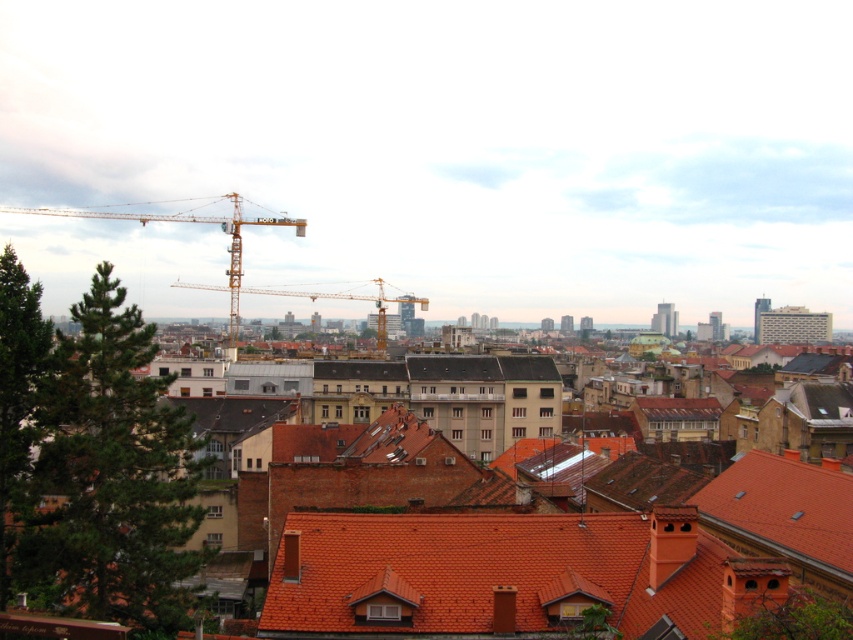
Is yellow metallic crane at upper center in front of metallic yellow crane at center?

Yes, yellow metallic crane at upper center is in front of metallic yellow crane at center.

Does yellow metallic crane at upper center have a larger size compared to metallic yellow crane at center?

Yes, yellow metallic crane at upper center is bigger than metallic yellow crane at center.

This screenshot has height=640, width=853. What do you see at coordinates (238, 257) in the screenshot?
I see `yellow metallic crane at upper center` at bounding box center [238, 257].

Where is `yellow metallic crane at upper center`? This screenshot has width=853, height=640. yellow metallic crane at upper center is located at coordinates (238, 257).

Which is more to the right, terracotta tiled roof at center or metallic yellow crane at center?

From the viewer's perspective, terracotta tiled roof at center appears more on the right side.

Find the location of a particular element. Image resolution: width=853 pixels, height=640 pixels. terracotta tiled roof at center is located at coordinates (509, 576).

The width and height of the screenshot is (853, 640). In order to click on terracotta tiled roof at center in this screenshot , I will do `click(509, 576)`.

This screenshot has width=853, height=640. In order to click on terracotta tiled roof at center in this screenshot , I will do `click(509, 576)`.

The width and height of the screenshot is (853, 640). What do you see at coordinates (498, 557) in the screenshot?
I see `brown brick building at center` at bounding box center [498, 557].

Is brown brick building at center thinner than terracotta tiled roof at center?

In fact, brown brick building at center might be wider than terracotta tiled roof at center.

Does point (409, 468) lie in front of point (460, 547)?

That is False.

The height and width of the screenshot is (640, 853). Identify the location of brown brick building at center. (498, 557).